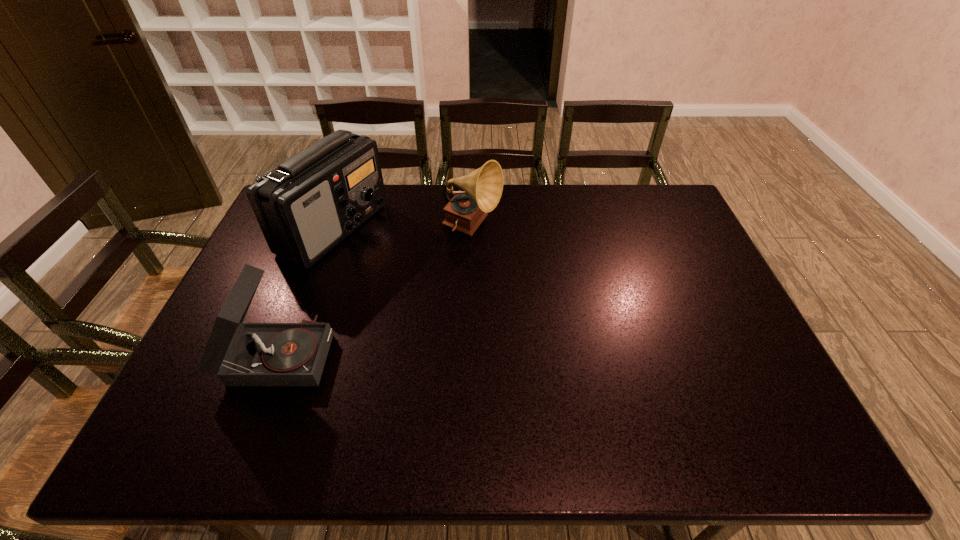
Image resolution: width=960 pixels, height=540 pixels. I want to click on vacant space that is in between the left phonograph_record and the radio receiver, so click(306, 291).

Where is `vacant area between the radio receiver and the nearer phonograph_record`? Image resolution: width=960 pixels, height=540 pixels. vacant area between the radio receiver and the nearer phonograph_record is located at coordinates (306, 291).

This screenshot has height=540, width=960. I want to click on free space between the nearer phonograph_record and the rightmost object, so [375, 291].

Find the location of a particular element. free space between the farther phonograph_record and the radio receiver is located at coordinates (403, 229).

Image resolution: width=960 pixels, height=540 pixels. Identify the location of vacant space that's between the left phonograph_record and the radio receiver. (306, 291).

Where is `free space that is in between the right phonograph_record and the nearest object`? This screenshot has width=960, height=540. free space that is in between the right phonograph_record and the nearest object is located at coordinates (375, 291).

This screenshot has height=540, width=960. Identify the location of vacant point located between the farther phonograph_record and the nearer phonograph_record. (375, 291).

Locate an element on the screen. The height and width of the screenshot is (540, 960). the second closest object to the radio receiver is located at coordinates (483, 187).

The image size is (960, 540). I want to click on object that is the second closest one to the right phonograph_record, so click(241, 354).